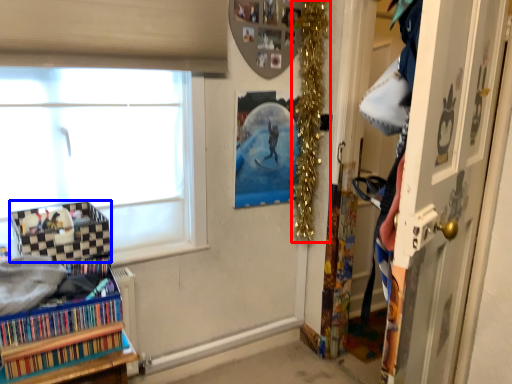
Question: Which of the following is the farthest to the observer, christmas decoration (highlighted by a red box) or shelf (highlighted by a blue box)?

Choices:
 (A) christmas decoration
 (B) shelf

Answer: (A)